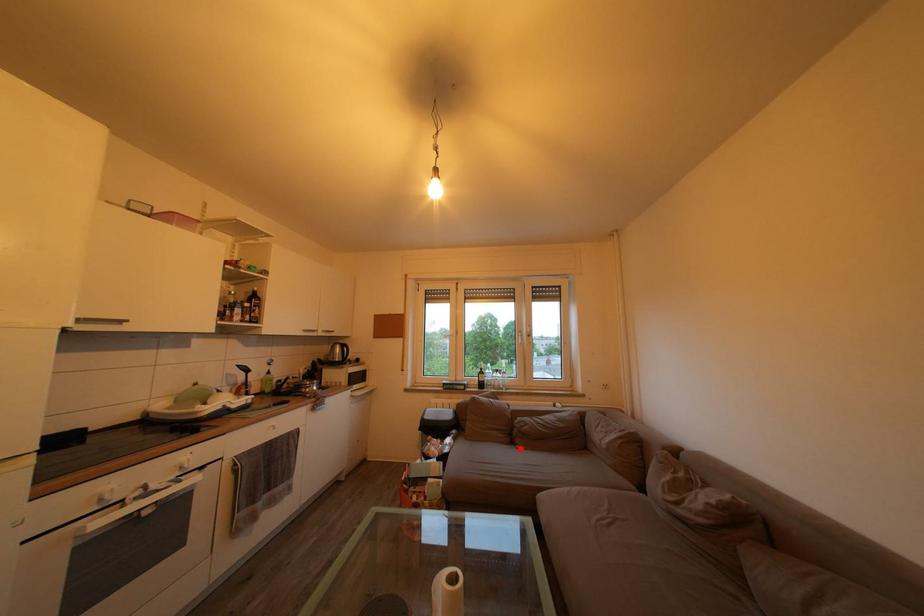
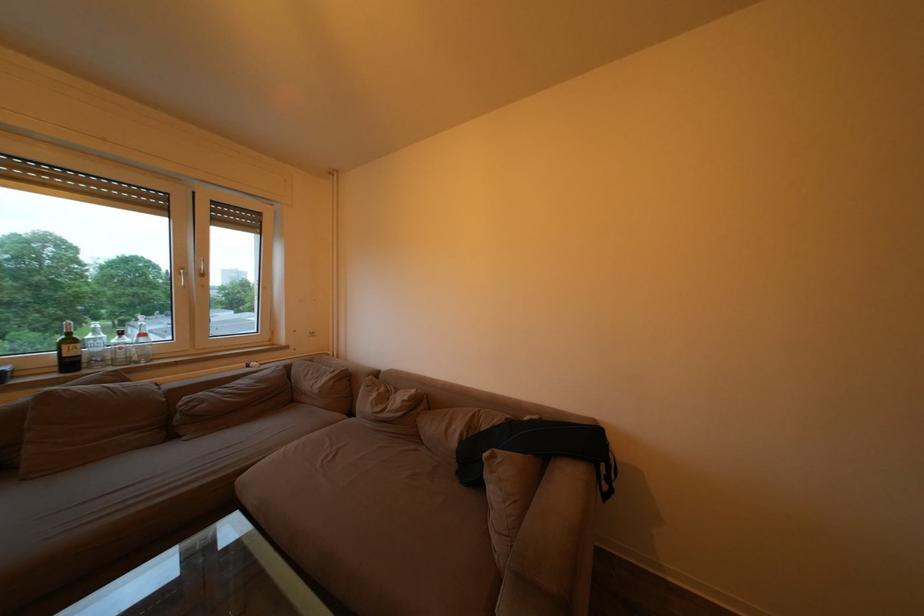
The point at the highlighted location is marked in the first image. Where is the corresponding point in the second image?

(178, 443)